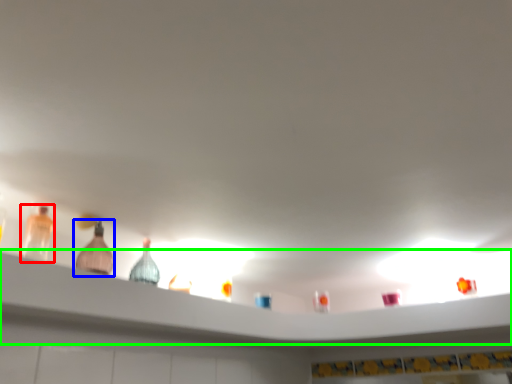
Question: Based on their relative distances, which object is farther from bottle (highlighted by a red box)? Choose from bottle (highlighted by a blue box) and shelf (highlighted by a green box).

Choices:
 (A) bottle
 (B) shelf

Answer: (B)